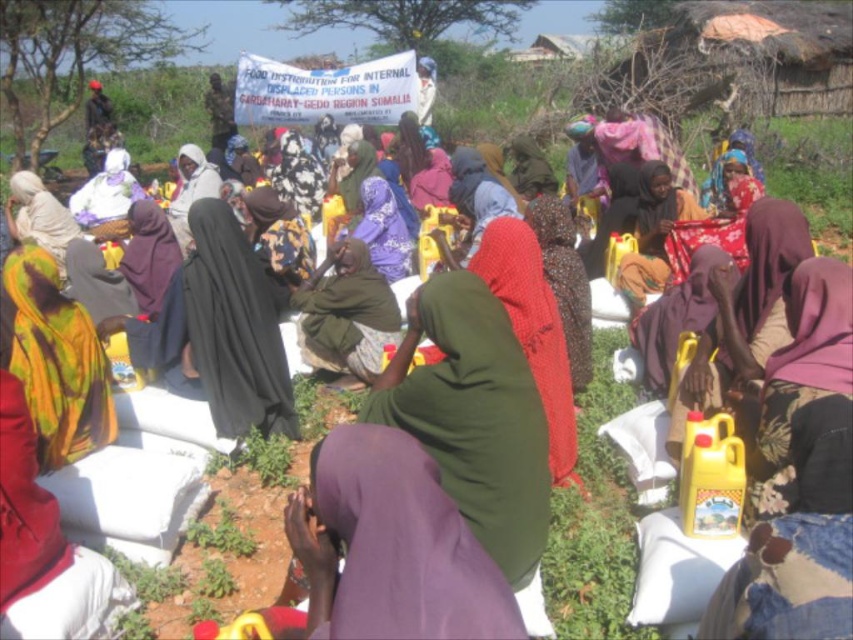
What is the spatial relationship between the printed fabric headscarf at lower left and the matte purple scarf at center?

The printed fabric headscarf at lower left is located below the matte purple scarf at center.